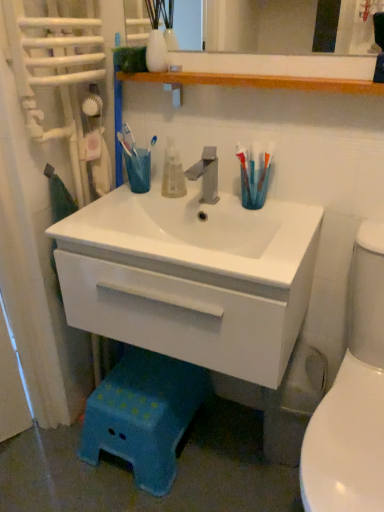
Question: Is translucent plastic toothbrush at right spatially inside satin nickel faucet at center, or outside of it?

Choices:
 (A) inside
 (B) outside

Answer: (B)

Question: From a real-world perspective, is translucent plastic toothbrush at right positioned above or below satin nickel faucet at center?

Choices:
 (A) below
 (B) above

Answer: (B)

Question: Considering the real-world distances, which object is farthest from the satin nickel faucet at center?

Choices:
 (A) blue plastic step stool at lower center
 (B) translucent plastic mouthwash at center
 (C) white glossy toilet at right
 (D) white glossy cabinet at center
 (E) translucent plastic toothbrush at right

Answer: (A)

Question: Estimate the real-world distances between objects in this image. Which object is farther from the white glossy toilet at right?

Choices:
 (A) satin nickel faucet at center
 (B) translucent plastic mouthwash at center
 (C) white glossy cabinet at center
 (D) blue plastic step stool at lower center
 (E) translucent plastic toothbrush at right

Answer: (B)